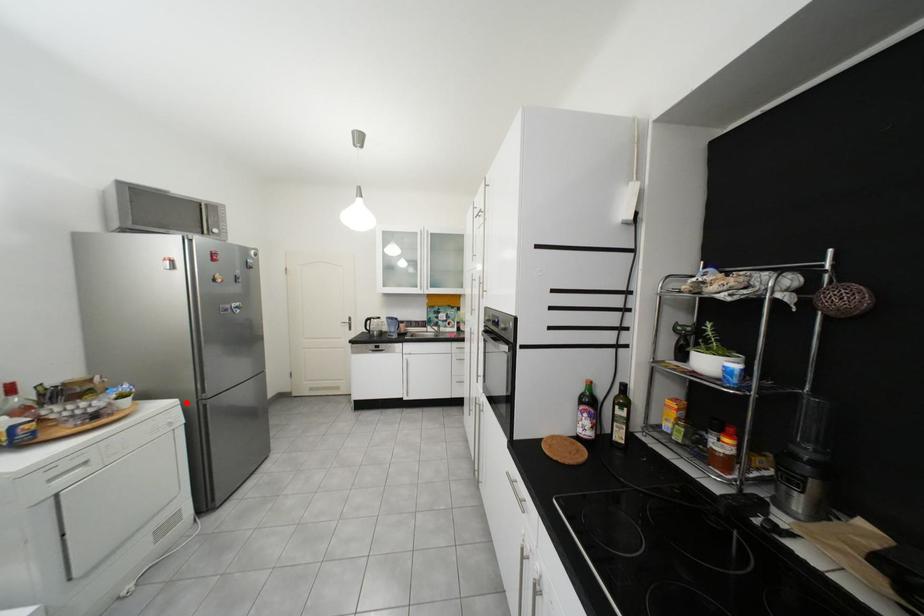
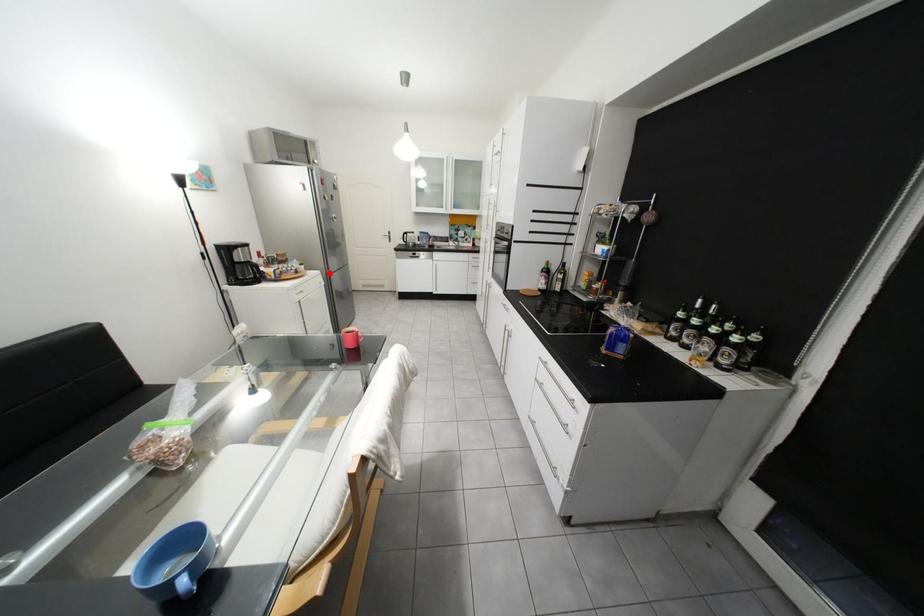
I am providing you with two images of the same scene from different viewpoints. A red point is marked on the first image and another point is marked on the second image. Does the point marked in image1 correspond to the same location as the one in image2?

Yes